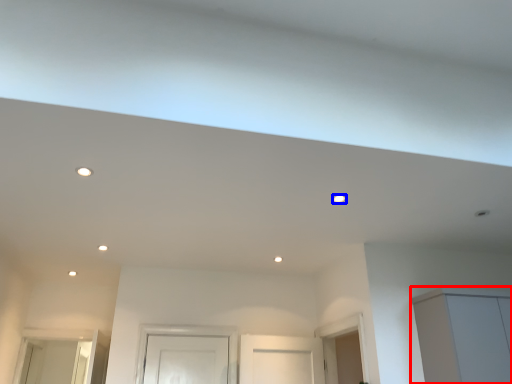
Question: Which object is closer to the camera taking this photo, cabinetry (highlighted by a red box) or lighting (highlighted by a blue box)?

Choices:
 (A) cabinetry
 (B) lighting

Answer: (B)